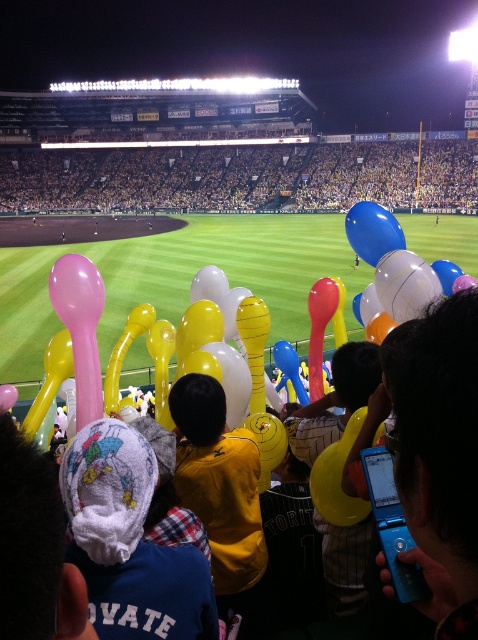
You are a photographer standing at the edge of the baseball stadium field. You want to take a photo that includes both the blue plastic flip phone at lower right and the blue glossy balloon at center. What is the minimum distance you need to move backward to ensure both objects are in frame?

The blue plastic flip phone at lower right and blue glossy balloon at center are 5.82 meters apart. To include both in the photo, you need to move backward until the camera can capture a field of view that spans at least 5.82 meters between them.

You are a photographer standing at the edge of the baseball stadium stands. You want to take a photo that includes both the blue plastic flip phone at lower right and the blue glossy balloon at center. Which object will appear larger in your photo?

The blue plastic flip phone at lower right is closer to the viewer than the blue glossy balloon at center, so it will appear larger in the photo.